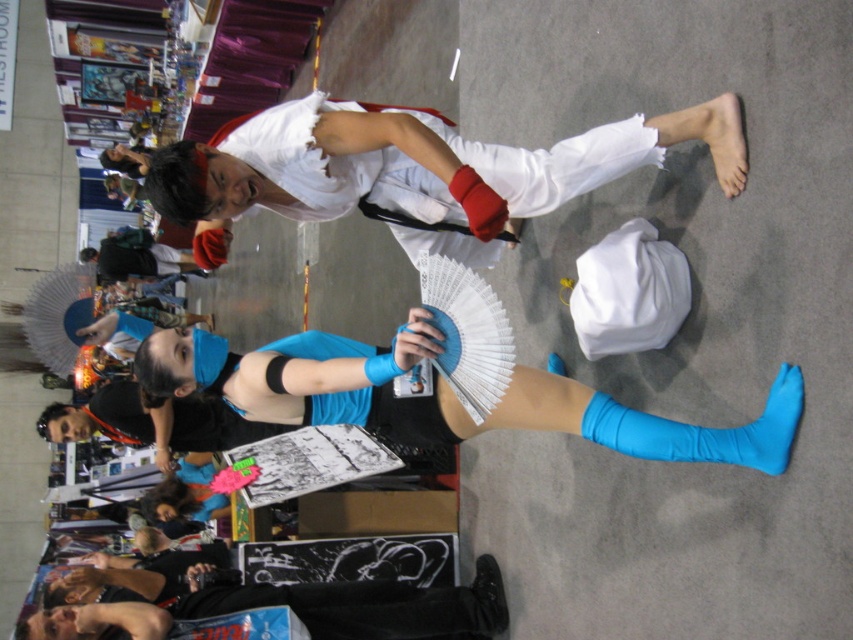
Locate an element on the screen. This screenshot has width=853, height=640. black leather jacket at lower left is located at coordinates (300, 609).

You are a GUI agent. You are given a task and a screenshot of the screen. Output one action in this format:
    pyautogui.click(x=<x>, y=<y>)
    Task: Click on the black leather jacket at lower left
    This screenshot has width=853, height=640.
    Given the screenshot: What is the action you would take?
    pyautogui.click(x=300, y=609)